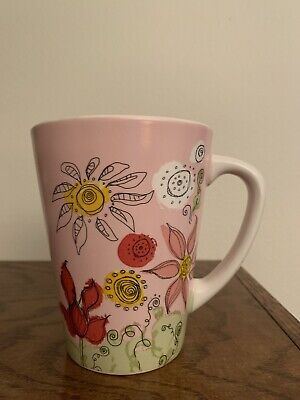
Find the location of a particular element. mug handle is located at coordinates tap(243, 240).